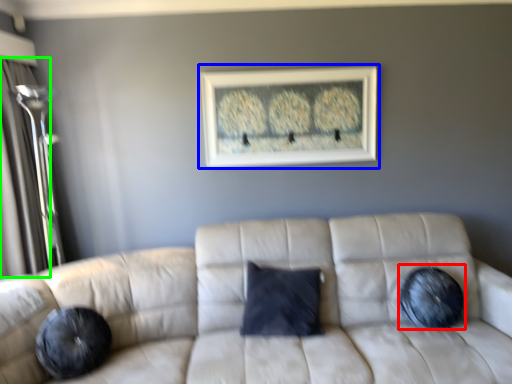
Question: Which object is the farthest from pillow (highlighted by a red box)? Choose among these: picture frame (highlighted by a blue box) or glass door (highlighted by a green box).

Choices:
 (A) picture frame
 (B) glass door

Answer: (B)